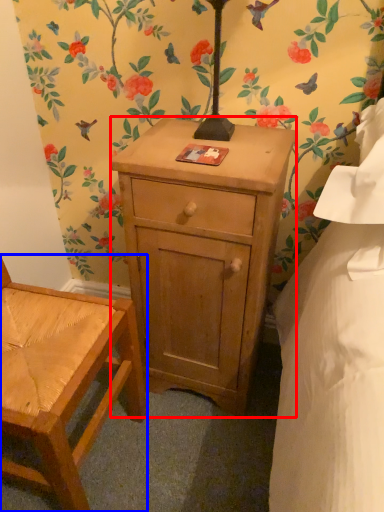
Question: Among these objects, which one is nearest to the camera, nightstand (highlighted by a red box) or chair (highlighted by a blue box)?

Choices:
 (A) nightstand
 (B) chair

Answer: (B)